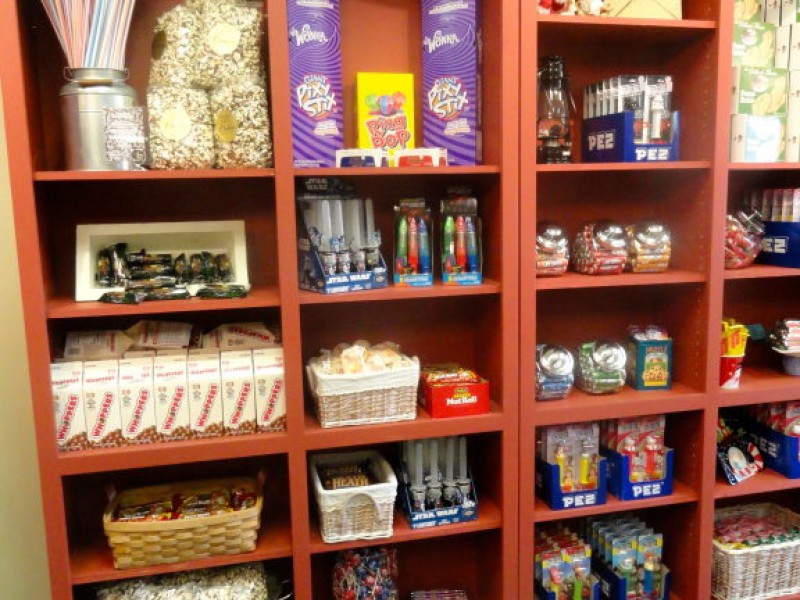
In order to click on back of shelf in this screenshot , I will do `click(140, 43)`, `click(389, 42)`, `click(585, 56)`, `click(586, 201)`, `click(593, 321)`, `click(421, 331)`, `click(422, 561)`, `click(161, 201)`.